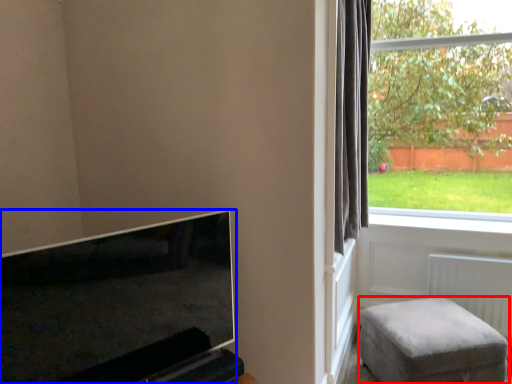
Question: Which of the following is the farthest to the observer, furniture (highlighted by a red box) or television (highlighted by a blue box)?

Choices:
 (A) furniture
 (B) television

Answer: (A)